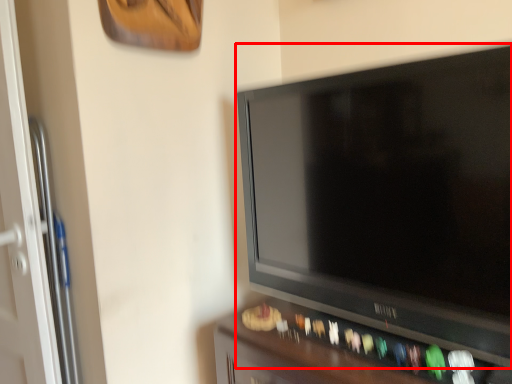
Question: From the image's perspective, where is television (annotated by the red box) located relative to furniture?

Choices:
 (A) below
 (B) above

Answer: (B)